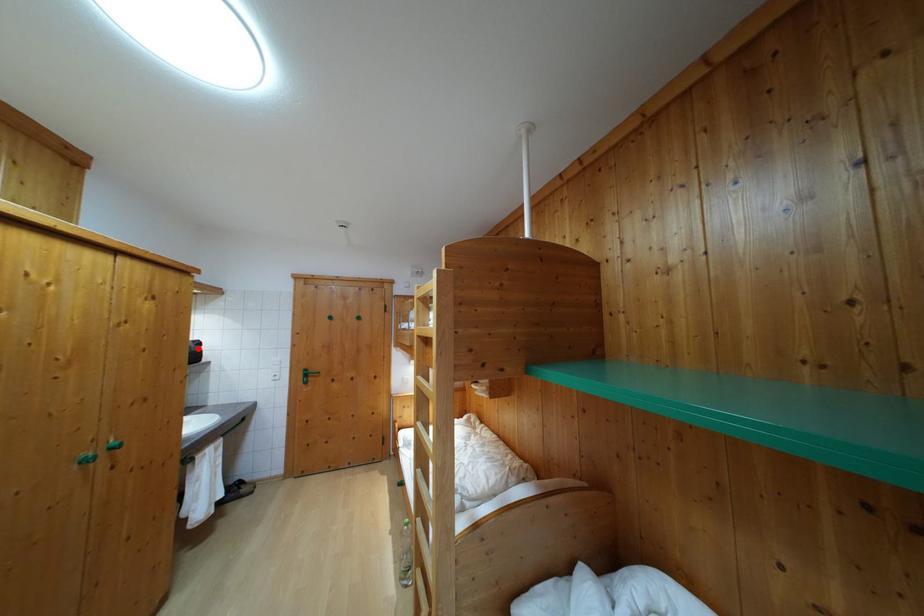
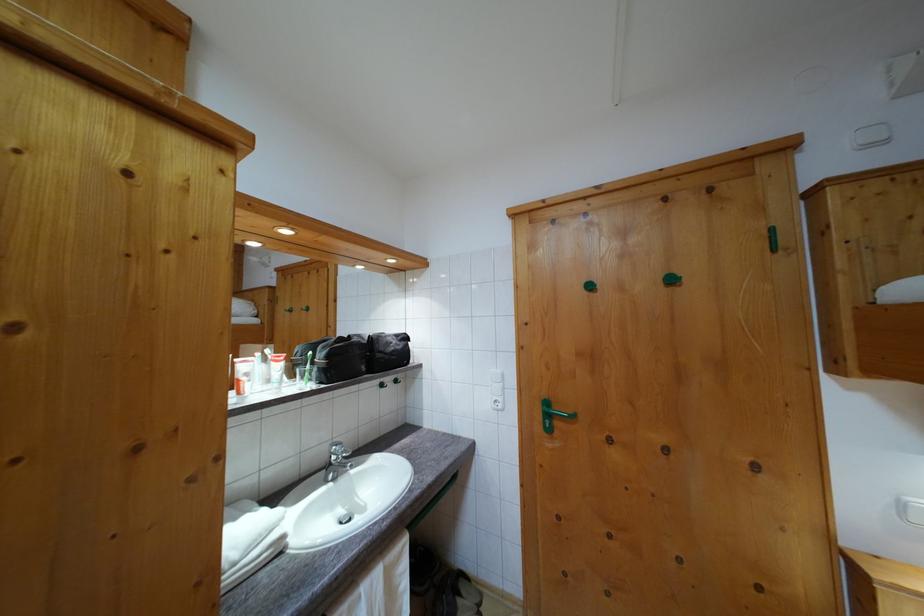
In the second image, find the point that corresponds to the highlighted location in the first image.

(400, 342)